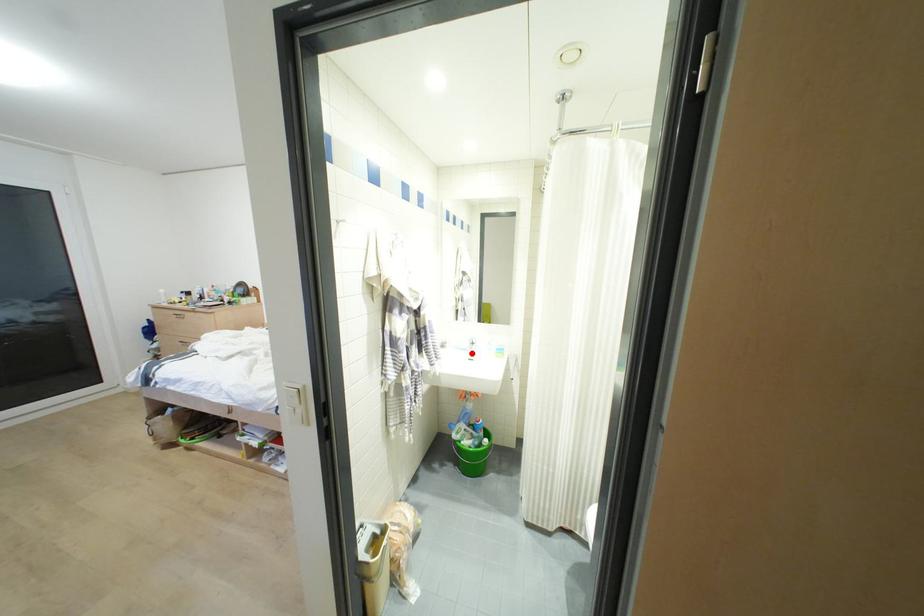
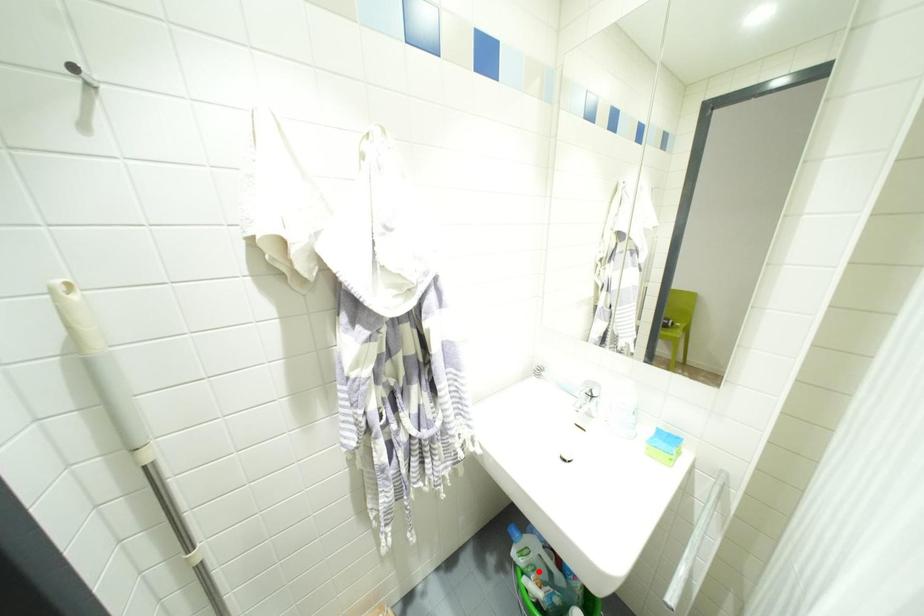
I am providing you with two images of the same scene from different viewpoints. A red point is marked on the first image and another point is marked on the second image. Does the point marked in image1 correspond to the same location as the one in image2?

No